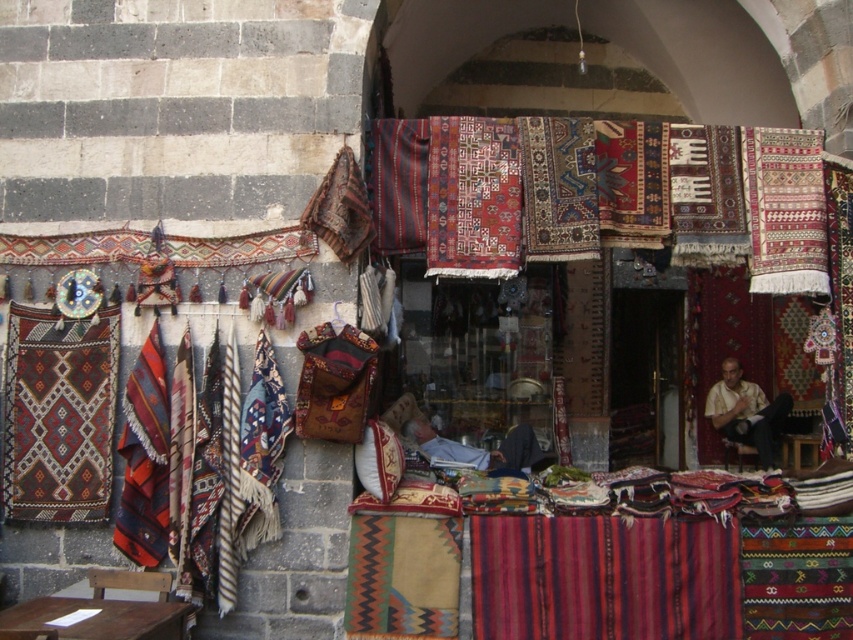
Between point (407, 248) and point (752, 444), which one is positioned behind?

The point (752, 444) is behind.

Is striped wool rug at center wider than light brown woven shirt at center?

No.

Measure the distance between point (416, 129) and camera.

6.41 meters

Locate an element on the screen. Image resolution: width=853 pixels, height=640 pixels. striped wool rug at center is located at coordinates (398, 182).

Does multicolored woven rug at upper right have a larger size compared to striped wool rug at center?

Indeed, multicolored woven rug at upper right has a larger size compared to striped wool rug at center.

In order to click on multicolored woven rug at upper right in this screenshot , I will do `click(785, 209)`.

At what (x,y) coordinates should I click in order to perform the action: click on multicolored woven rug at upper right. Please return your answer as a coordinate pair (x, y). Image resolution: width=853 pixels, height=640 pixels. Looking at the image, I should click on (785, 209).

From the picture: Is multicolored woven rug at center smaller than light brown woven shirt at center?

Yes.

The width and height of the screenshot is (853, 640). In order to click on multicolored woven rug at center in this screenshot , I will do `click(560, 188)`.